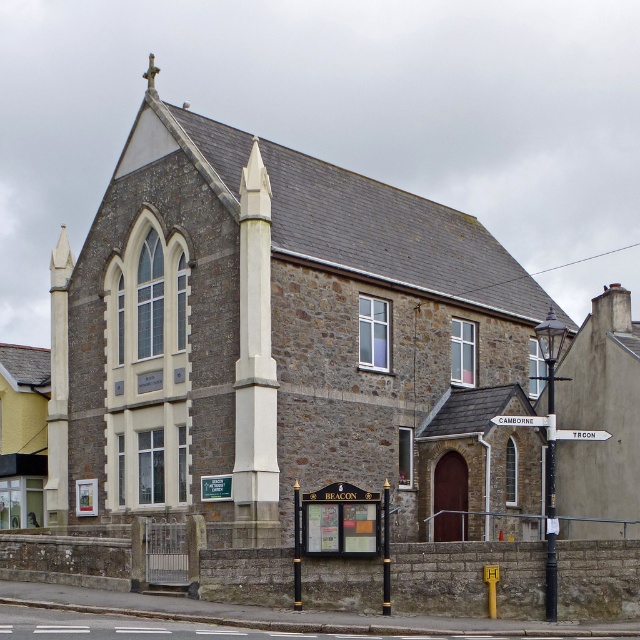
You are standing at the entrance of Beacon Methodist Church and see a point marked at coordinates [253,369]. Which object is this point located on?

The point marked at coordinates [253,369] is located on the white stone obelisk at center.

You are standing in front of Beacon Methodist Church and want to find the entrance. You see a white stone obelisk at center and a white wooden signpost at upper center. Which object is closer to you?

The white stone obelisk at center is positioned over the white wooden signpost at upper center, so the white stone obelisk at center is closer to you.